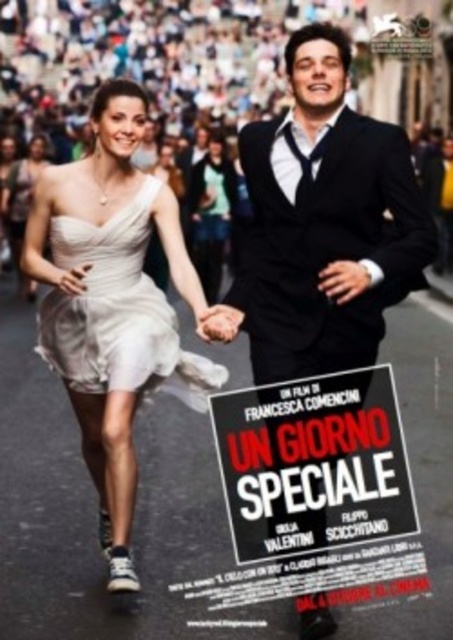
Looking at the movie poster for Un Giorno Speciale, you notice the matte white text at center and the smooth skin hand at center. Which object is positioned lower in the image?

The matte white text at center is located below the smooth skin hand at center, so the matte white text at center is positioned lower in the image.

Based on the movie poster for Un Giorno Speciale, which character is wearing clothing that is larger in size between the shiny black suit at center and the satin white dress at center?

The shiny black suit at center is larger in size than the satin white dress at center.